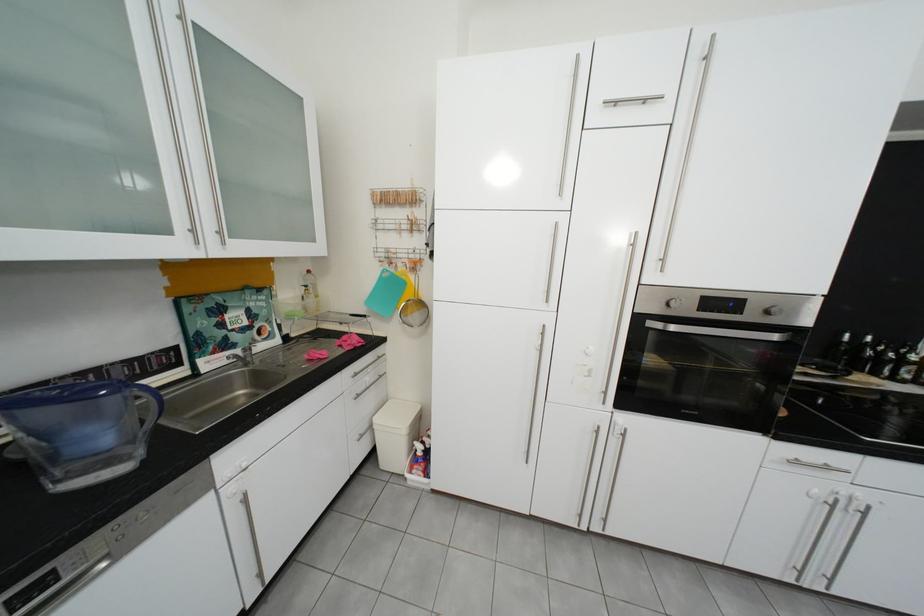
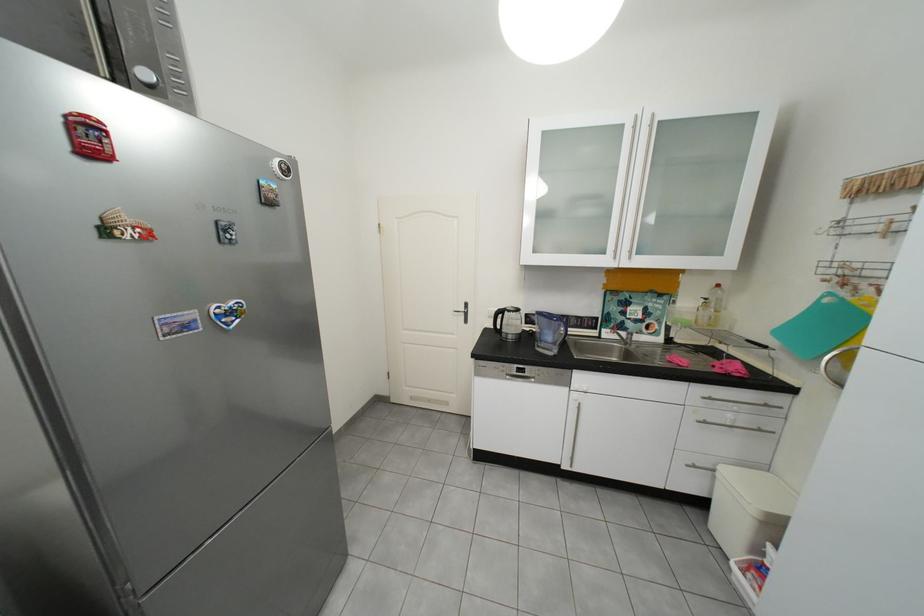
Where in the second image is the point corresponding to the point at 370,397 from the first image?

(718, 424)